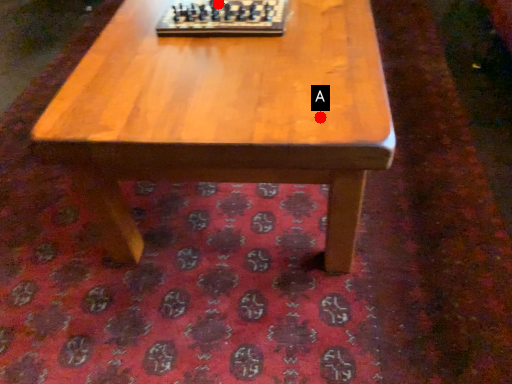
Question: Two points are circled on the image, labeled by A and B beside each circle. Which point is closer to the camera taking this photo?

Choices:
 (A) A is closer
 (B) B is closer

Answer: (A)